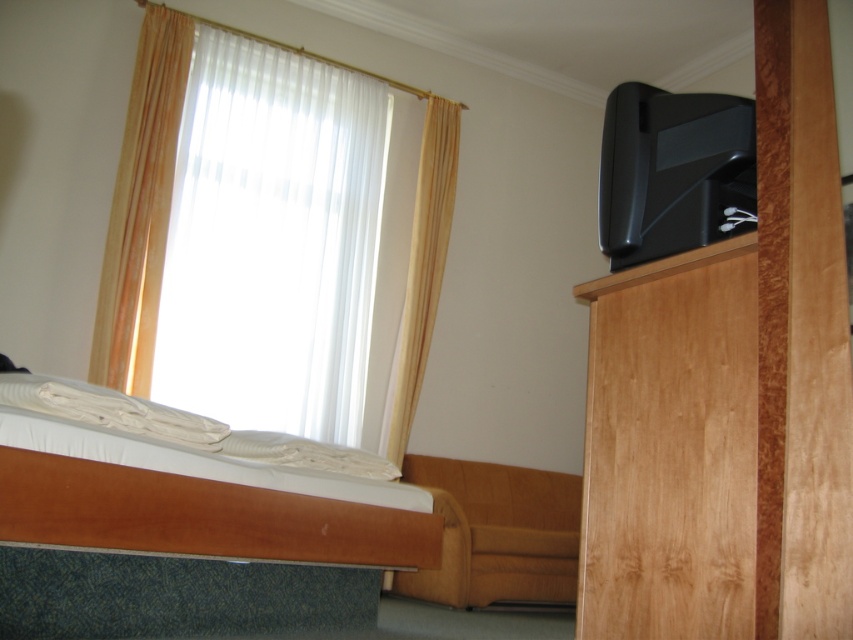
Consider the image. Who is lower down, white matte bed at lower left or beige fabric curtain at upper left?

white matte bed at lower left

Can you confirm if white matte bed at lower left is shorter than beige fabric curtain at upper left?

Correct, white matte bed at lower left is not as tall as beige fabric curtain at upper left.

Is point (245, 604) behind point (428, 248)?

That is False.

The width and height of the screenshot is (853, 640). I want to click on white matte bed at lower left, so 180,525.

Is white sheer curtain at upper left wider than beige fabric curtain at upper left?

Indeed, white sheer curtain at upper left has a greater width compared to beige fabric curtain at upper left.

Between white sheer curtain at upper left and beige fabric curtain at upper left, which one is positioned lower?

beige fabric curtain at upper left

I want to click on white sheer curtain at upper left, so click(271, 241).

Can you confirm if white matte bed at lower left is positioned to the right of white sheer curtain at upper left?

Correct, you'll find white matte bed at lower left to the right of white sheer curtain at upper left.

Between point (33, 374) and point (363, 104), which one is positioned in front?

Positioned in front is point (33, 374).

Is point (172, 449) closer to viewer compared to point (274, 352)?

Yes, point (172, 449) is closer to viewer.

Find the location of a particular element. The width and height of the screenshot is (853, 640). white matte bed at lower left is located at coordinates (180, 525).